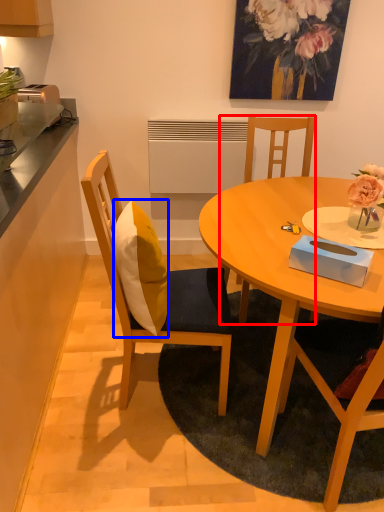
Question: Which object appears farthest to the camera in this image, chair (highlighted by a red box) or pillow (highlighted by a blue box)?

Choices:
 (A) chair
 (B) pillow

Answer: (A)